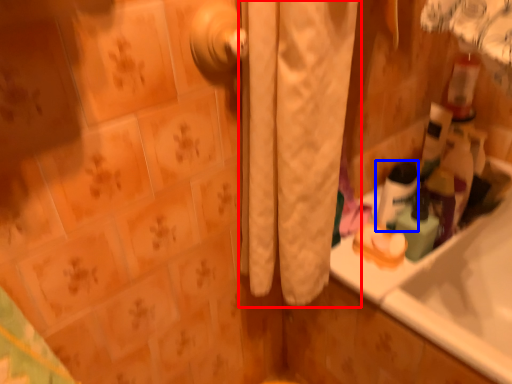
Question: Which point is closer to the camera, curtain (highlighted by a red box) or mouthwash (highlighted by a blue box)?

Choices:
 (A) curtain
 (B) mouthwash

Answer: (A)